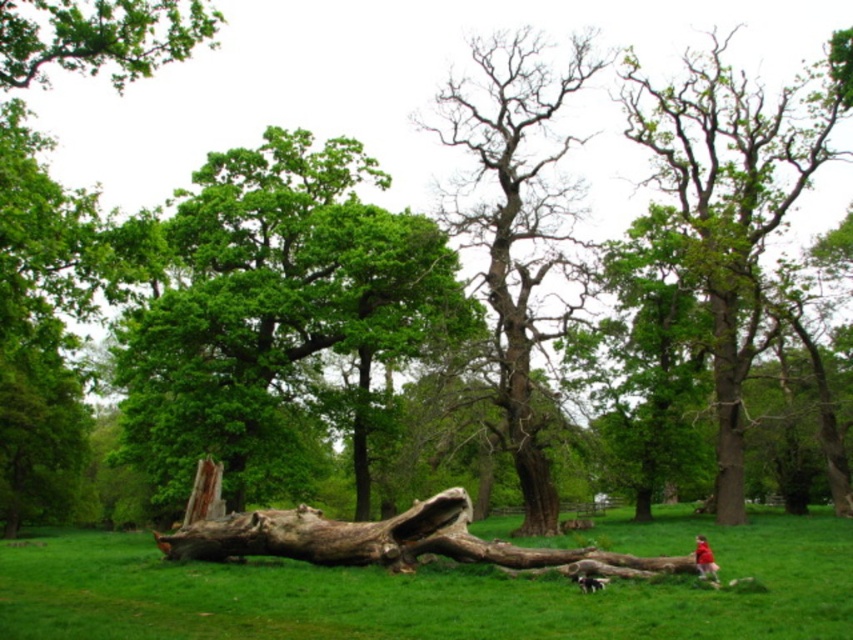
Where is `smooth bark log at center`? smooth bark log at center is located at coordinates (433, 592).

Which is behind, point (515, 589) or point (704, 552)?

The point (704, 552) is more distant.

Locate an element on the screen. This screenshot has width=853, height=640. smooth bark log at center is located at coordinates point(433,592).

Where is `smooth bark log at center`? The height and width of the screenshot is (640, 853). smooth bark log at center is located at coordinates (433, 592).

Which is in front, point (463, 605) or point (78, 29)?

Point (463, 605) is more forward.

This screenshot has height=640, width=853. In order to click on smooth bark log at center in this screenshot , I will do `click(433, 592)`.

Does point (389, 225) come in front of point (19, 51)?

That is False.

At what (x,y) coordinates should I click in order to perform the action: click on green leafy tree at center. Please return your answer as a coordinate pair (x, y). The height and width of the screenshot is (640, 853). Looking at the image, I should click on (273, 308).

Where is `green leafy tree at center`? The image size is (853, 640). green leafy tree at center is located at coordinates (273, 308).

What are the coordinates of `green leafy tree at center` in the screenshot? It's located at (273, 308).